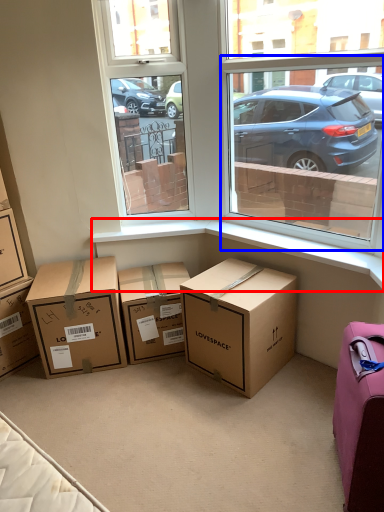
Question: Which point is closer to the camera, window sill (highlighted by a red box) or window screen (highlighted by a blue box)?

Choices:
 (A) window sill
 (B) window screen

Answer: (B)